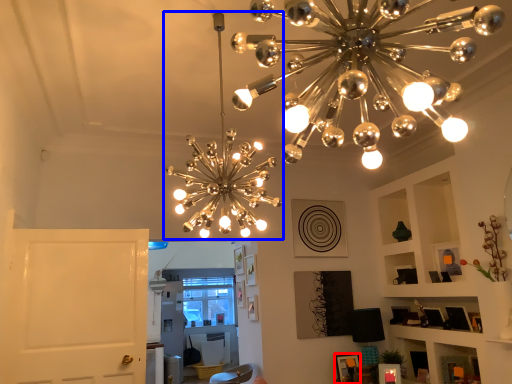
Question: Among these objects, which one is nearest to the camera, picture frame (highlighted by a red box) or lamp (highlighted by a blue box)?

Choices:
 (A) picture frame
 (B) lamp

Answer: (B)